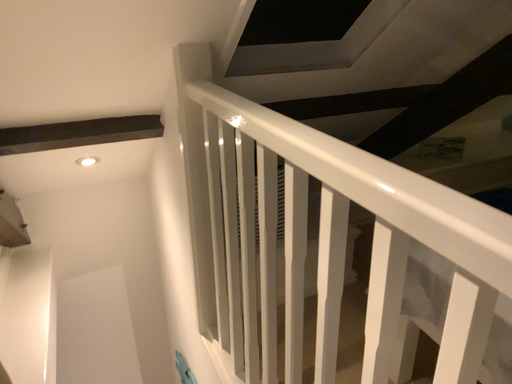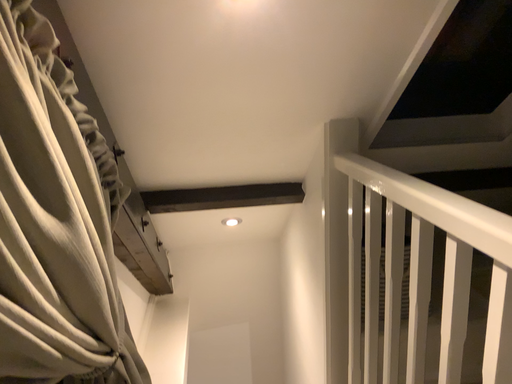
Question: How did the camera likely rotate when shooting the video?

Choices:
 (A) rotated upward
 (B) rotated downward

Answer: (A)